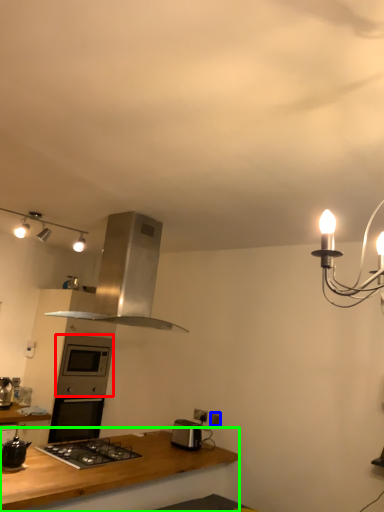
Question: Which object is positioned closest to oven (highlighted by a red box)? Select from electric outlet (highlighted by a blue box) and countertop (highlighted by a green box).

Choices:
 (A) electric outlet
 (B) countertop

Answer: (B)